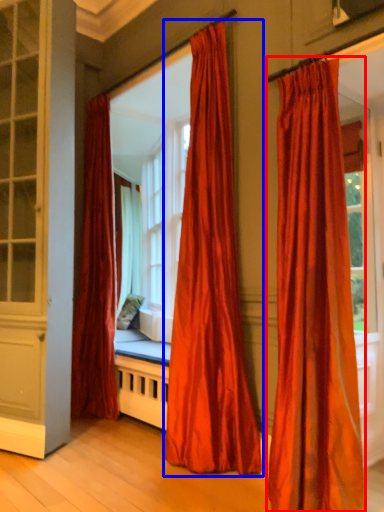
Question: Which object is closer to the camera taking this photo, curtain (highlighted by a red box) or curtain (highlighted by a blue box)?

Choices:
 (A) curtain
 (B) curtain

Answer: (A)